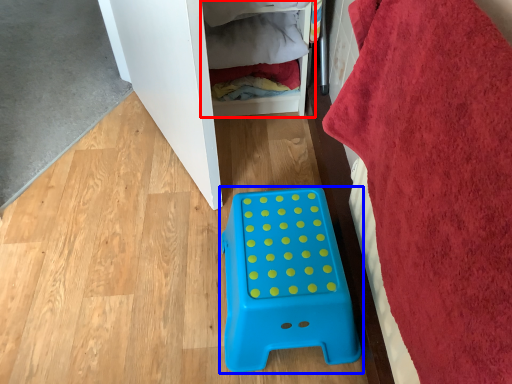
Question: Which of the following is the farthest to the observer, shelf (highlighted by a red box) or furniture (highlighted by a blue box)?

Choices:
 (A) shelf
 (B) furniture

Answer: (A)